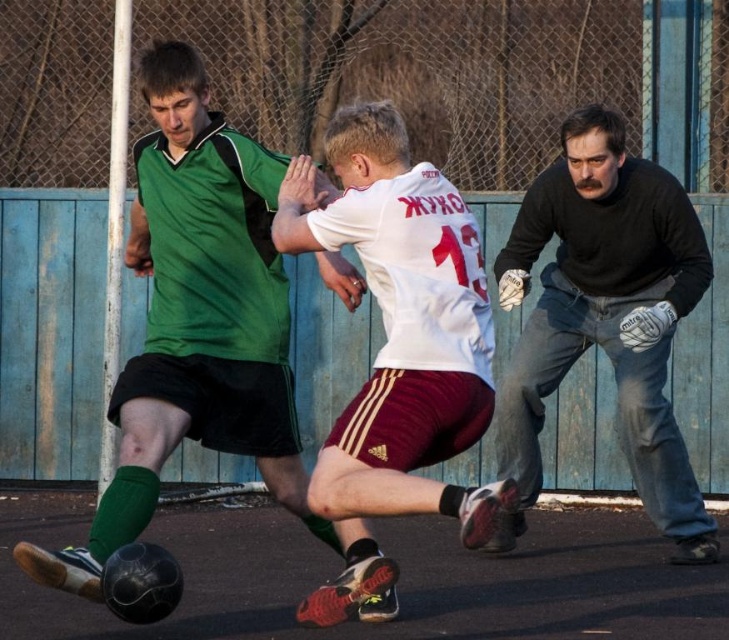
Is matte green jersey at center to the left of white matte jersey at center from the viewer's perspective?

Indeed, matte green jersey at center is positioned on the left side of white matte jersey at center.

Locate an element on the screen. matte green jersey at center is located at coordinates (200, 326).

Between point (246, 196) and point (421, 280), which one is positioned in front?

Point (421, 280) is more forward.

Find the location of a particular element. Image resolution: width=729 pixels, height=640 pixels. matte green jersey at center is located at coordinates pos(200,326).

Does matte green jersey at center appear over black matte gloves at right?

Correct, matte green jersey at center is located above black matte gloves at right.

Is matte green jersey at center positioned at the back of black matte gloves at right?

No, matte green jersey at center is in front of black matte gloves at right.

The height and width of the screenshot is (640, 729). What are the coordinates of `matte green jersey at center` in the screenshot? It's located at (200, 326).

The image size is (729, 640). I want to click on matte green jersey at center, so click(200, 326).

Is white matte jersey at center smaller than black matte gloves at right?

Yes, white matte jersey at center is smaller than black matte gloves at right.

Is white matte jersey at center to the left of black matte gloves at right from the viewer's perspective?

Indeed, white matte jersey at center is positioned on the left side of black matte gloves at right.

Between point (324, 470) and point (588, 257), which one is positioned behind?

Positioned behind is point (588, 257).

I want to click on white matte jersey at center, so click(x=399, y=324).